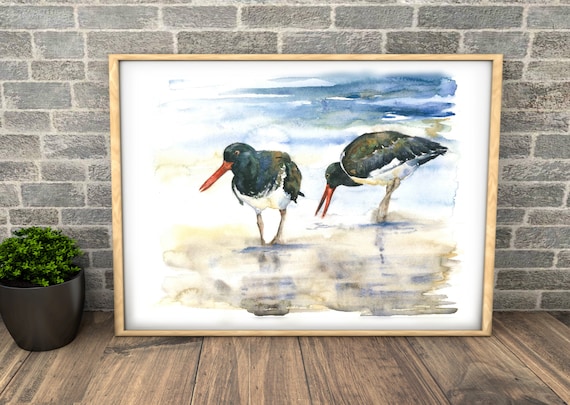
Locate an element on the screen. plastic pot is located at coordinates (39, 311).